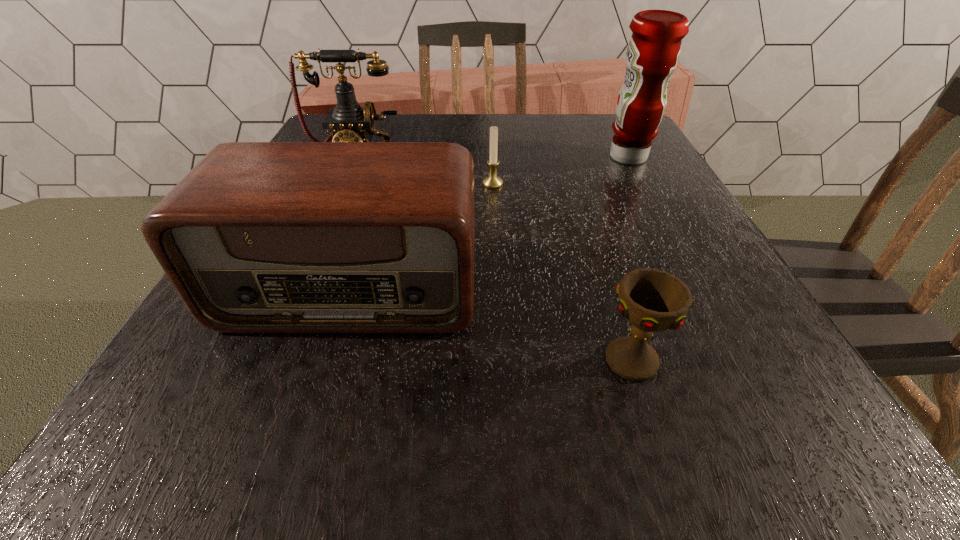
What are the coordinates of `vacant region between the condiment and the candle holder` in the screenshot? It's located at (561, 171).

Point out which object is positioned as the third nearest to the radio receiver. Please provide its 2D coordinates. Your answer should be formatted as a tuple, i.e. [(x, y)], where the tuple contains the x and y coordinates of a point satisfying the conditions above.

[(348, 122)]

Where is `the closest object to the fourth object from left to right`? This screenshot has width=960, height=540. the closest object to the fourth object from left to right is located at coordinates (259, 237).

Identify the location of vacant space that satisfies the following two spatial constraints: 1. on the front panel of the chalice; 2. on the right side of the radio receiver. This screenshot has height=540, width=960. (329, 360).